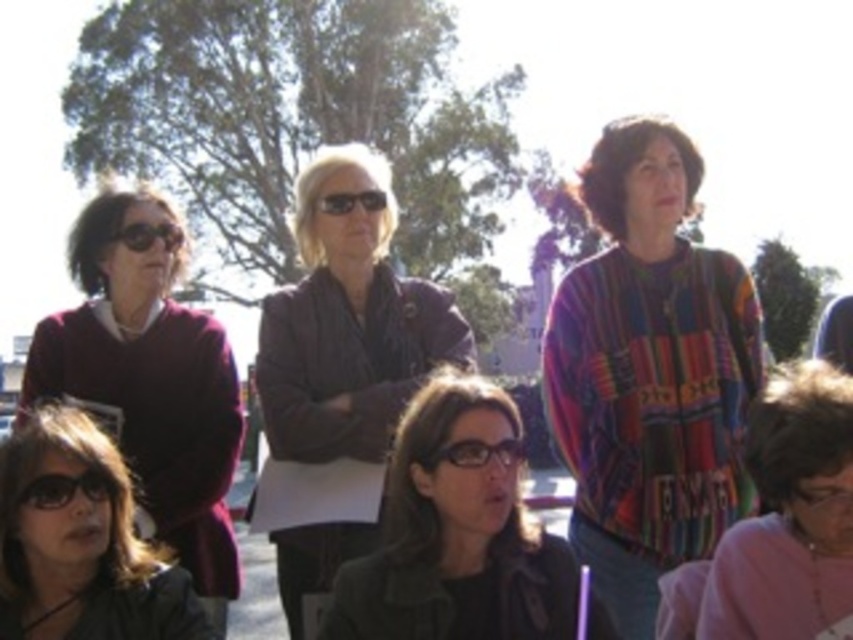
You are standing in a park and see a dark brown leather jacket at center and a shiny black sunglasses at center. Which object is positioned to the left?

The dark brown leather jacket at center is positioned to the left of the shiny black sunglasses at center.

You are a photographer trying to capture a photo of the matte black jacket at lower left without the multicolored woven sweater at center blocking the view. Can you adjust your position to do so?

The multicolored woven sweater at center is further to the viewer than the matte black jacket at lower left, so you can move to the side to avoid the sweater blocking the jacket.

You are a photographer trying to capture a photo of the matte maroon sweater at left and the black plastic glasses at lower left. Since the sweater is above the glasses, where should you position your camera to ensure both are in frame?

Position the camera so it can capture both the matte maroon sweater at left and the black plastic glasses at lower left. Since the sweater is above the glasses, angle the camera slightly downward to include both items in the frame.